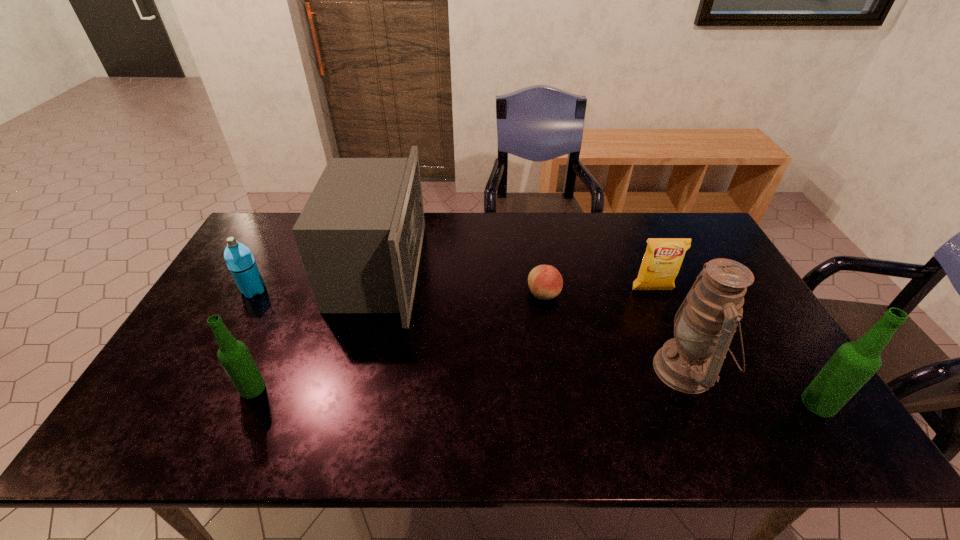
Find the location of a particular element. The width and height of the screenshot is (960, 540). free point between the shortest object and the crisp (potato chip) is located at coordinates (598, 292).

What are the coordinates of `blank region between the microwave oven and the oil lamp` in the screenshot? It's located at (532, 320).

Image resolution: width=960 pixels, height=540 pixels. I want to click on vacant area between the fourth object from left to right and the fourth shortest object, so click(398, 341).

Locate an element on the screen. The width and height of the screenshot is (960, 540). vacant space that's between the fourth tallest object and the thermos bottle is located at coordinates (253, 340).

This screenshot has width=960, height=540. Identify the location of free point between the crisp (potato chip) and the microwave oven. (516, 280).

The width and height of the screenshot is (960, 540). I want to click on vacant area between the crisp (potato chip) and the peach, so click(x=598, y=292).

Image resolution: width=960 pixels, height=540 pixels. Find the location of `object that is the fifth closest one to the fourth object from right to left`. object that is the fifth closest one to the fourth object from right to left is located at coordinates (235, 358).

At what (x,y) coordinates should I click in order to perform the action: click on object that stands as the fifth closest to the thermos bottle. Please return your answer as a coordinate pair (x, y). The image size is (960, 540). Looking at the image, I should click on (662, 260).

In order to click on vacant region that satisfies the following two spatial constraints: 1. on the front of the crisp (potato chip) with the logo; 2. on the right side of the oil lamp in this screenshot , I will do `click(685, 369)`.

This screenshot has height=540, width=960. What are the coordinates of `vacant space that satisfies the following two spatial constraints: 1. on the front of the oil lamp with the logo; 2. on the left side of the crisp (potato chip)` in the screenshot? It's located at (685, 369).